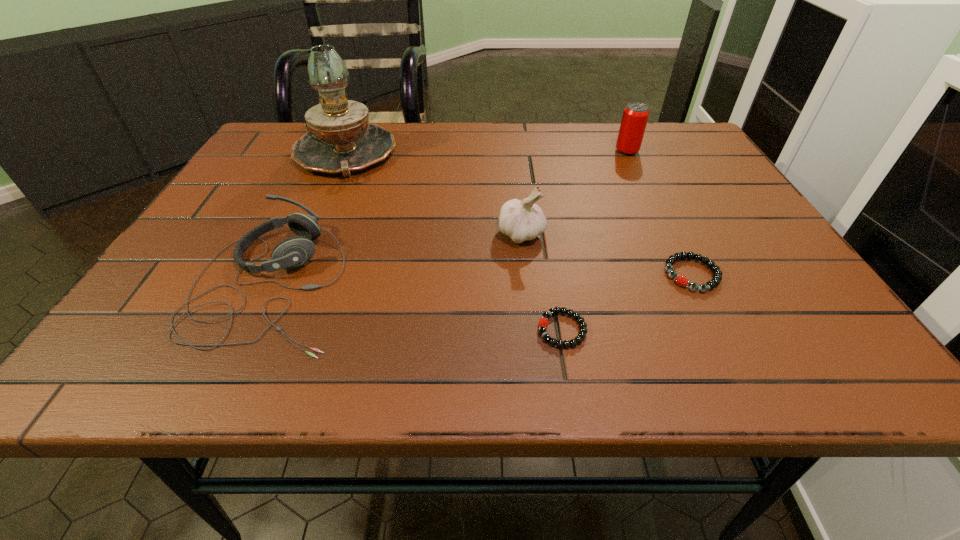
You are a GUI agent. You are given a task and a screenshot of the screen. Output one action in this format:
    pyautogui.click(x=<x>, y=<y>)
    Task: Click on the vacant point located 0.390m on the right of the garlic
    Image resolution: width=960 pixels, height=540 pixels.
    Given the screenshot: What is the action you would take?
    pyautogui.click(x=735, y=235)

Where is `free space located 0.250m on the outer surface of the fourth tallest object`? free space located 0.250m on the outer surface of the fourth tallest object is located at coordinates (484, 283).

The width and height of the screenshot is (960, 540). I want to click on free space located 0.090m on the front of the right bracelet, so click(722, 334).

The image size is (960, 540). I want to click on vacant space located on the left of the nearer bracelet, so click(x=452, y=329).

The width and height of the screenshot is (960, 540). Identify the location of oil lamp positioned at the far edge. (341, 141).

Locate an element on the screen. This screenshot has height=540, width=960. can present at the far edge is located at coordinates [x=635, y=116].

The height and width of the screenshot is (540, 960). What are the coordinates of `headset that is at the near edge` in the screenshot? It's located at (292, 252).

This screenshot has width=960, height=540. I want to click on bracelet that is at the near edge, so click(x=543, y=323).

Locate an element on the screen. This screenshot has height=540, width=960. oil lamp located in the left edge section of the desktop is located at coordinates (341, 141).

In order to click on headset at the left edge in this screenshot , I will do `click(292, 252)`.